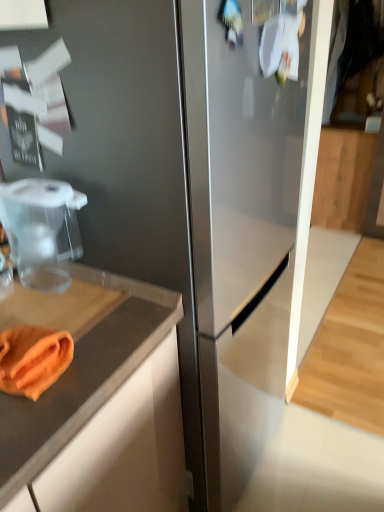
Question: Could you tell me if orange cloth at lower left is turned towards transparent plastic food processor at left?

Choices:
 (A) yes
 (B) no

Answer: (B)

Question: From the image's perspective, is orange cloth at lower left on transparent plastic food processor at left?

Choices:
 (A) no
 (B) yes

Answer: (A)

Question: Is orange cloth at lower left wider than transparent plastic food processor at left?

Choices:
 (A) yes
 (B) no

Answer: (B)

Question: Would you consider orange cloth at lower left to be distant from transparent plastic food processor at left?

Choices:
 (A) no
 (B) yes

Answer: (A)

Question: Can you confirm if orange cloth at lower left is positioned to the left of transparent plastic food processor at left?

Choices:
 (A) yes
 (B) no

Answer: (B)

Question: Is orange cloth at lower left oriented away from transparent plastic food processor at left?

Choices:
 (A) yes
 (B) no

Answer: (B)

Question: Is transparent plastic food processor at left at the left side of orange cloth at lower left?

Choices:
 (A) no
 (B) yes

Answer: (B)

Question: Can you confirm if transparent plastic food processor at left is bigger than orange cloth at lower left?

Choices:
 (A) yes
 (B) no

Answer: (A)

Question: Can you confirm if transparent plastic food processor at left is positioned to the right of orange cloth at lower left?

Choices:
 (A) yes
 (B) no

Answer: (B)

Question: Are transparent plastic food processor at left and orange cloth at lower left far apart?

Choices:
 (A) yes
 (B) no

Answer: (B)

Question: From the image's perspective, is transparent plastic food processor at left on orange cloth at lower left?

Choices:
 (A) yes
 (B) no

Answer: (A)

Question: Considering the relative sizes of transparent plastic food processor at left and orange cloth at lower left in the image provided, is transparent plastic food processor at left smaller than orange cloth at lower left?

Choices:
 (A) yes
 (B) no

Answer: (B)

Question: Does wooden cabinet at right have a lesser height compared to transparent plastic food processor at left?

Choices:
 (A) no
 (B) yes

Answer: (A)